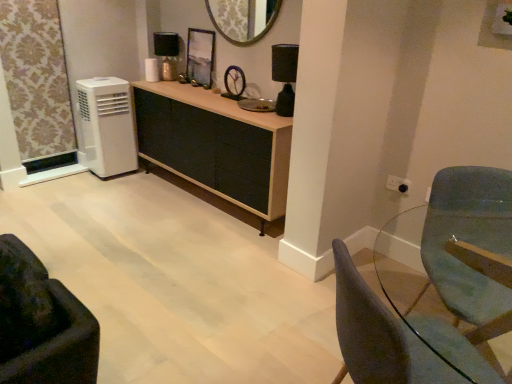
You are a GUI agent. You are given a task and a screenshot of the screen. Output one action in this format:
    pyautogui.click(x=<x>, y=<y>)
    Task: Click on the vacant space to the left of black matte lamp at upper right, which is the 2th lamp from left to right
    This screenshot has width=512, height=384.
    Given the screenshot: What is the action you would take?
    pyautogui.click(x=252, y=114)